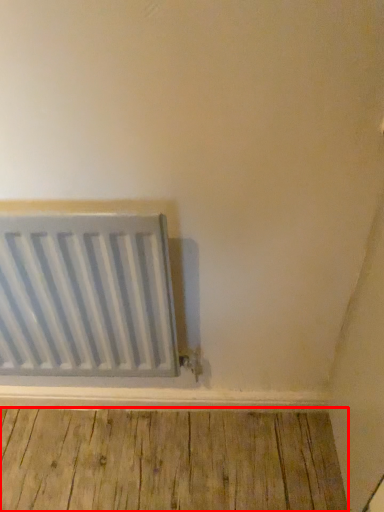
Question: Observing the image, what is the correct spatial positioning of hardwood (annotated by the red box) in reference to radiator?

Choices:
 (A) left
 (B) right

Answer: (B)